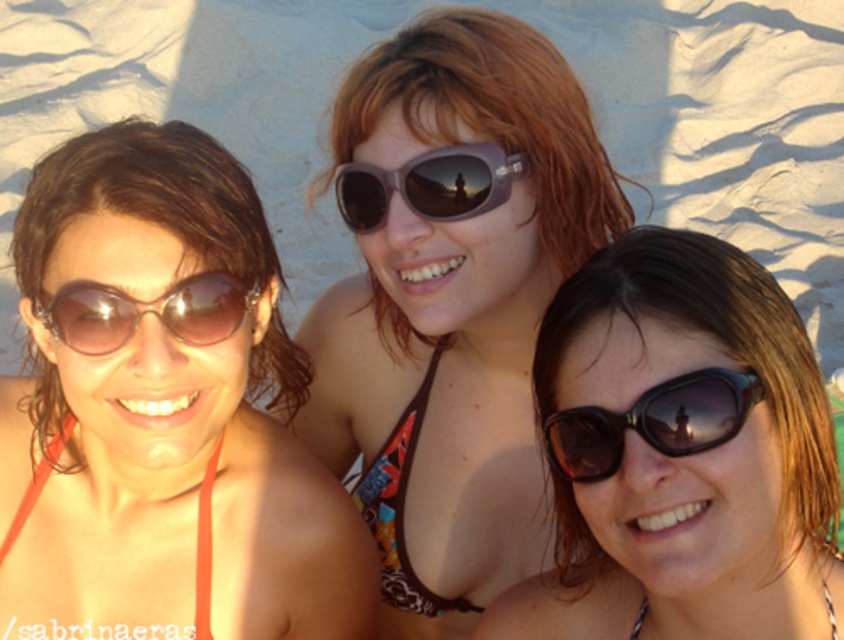
Question: Which point is closer to the camera?

Choices:
 (A) (663, 394)
 (B) (579, 467)

Answer: (A)

Question: Is matte brown bikini top at center positioned at the back of black matte sunglasses at lower right?

Choices:
 (A) no
 (B) yes

Answer: (B)

Question: Which of the following is the farthest from the observer?

Choices:
 (A) (241, 310)
 (B) (299, 605)

Answer: (B)

Question: Which object is positioned farthest from the matte brown sunglasses at left?

Choices:
 (A) matte brown bikini top at center
 (B) sunglasses at center
 (C) black plastic sunglasses at center
 (D) black matte sunglasses at lower right

Answer: (C)

Question: Is black plastic sunglasses at center above matte brown sunglasses at left?

Choices:
 (A) no
 (B) yes

Answer: (A)

Question: Is matte brown bikini top at center below matte brown sunglasses at left?

Choices:
 (A) no
 (B) yes

Answer: (B)